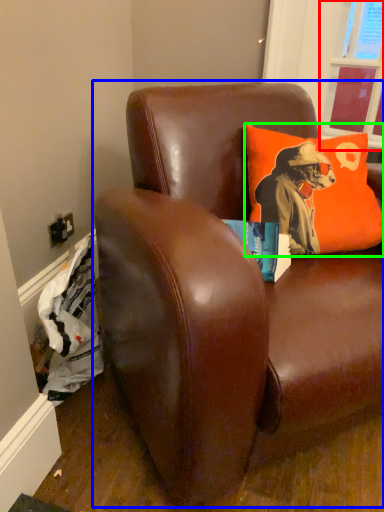
Question: Which object is the closest to the window screen (highlighted by a red box)? Choose among these: studio couch (highlighted by a blue box) or pillow (highlighted by a green box).

Choices:
 (A) studio couch
 (B) pillow

Answer: (B)